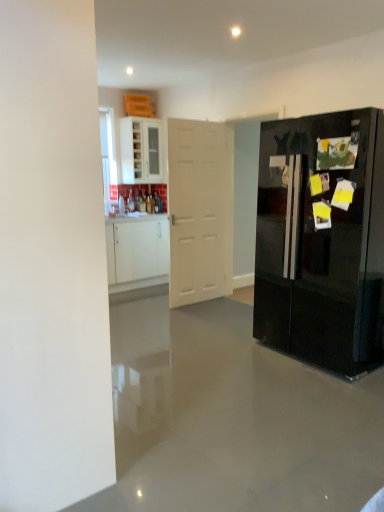
Question: Does glossy black refrigerator at right have a greater height compared to white matte door at center?

Choices:
 (A) no
 (B) yes

Answer: (A)

Question: Is white matte door at center inside glossy black refrigerator at right?

Choices:
 (A) no
 (B) yes

Answer: (A)

Question: Is glossy black refrigerator at right not within white matte door at center?

Choices:
 (A) yes
 (B) no

Answer: (A)

Question: From a real-world perspective, is glossy black refrigerator at right physically below white matte door at center?

Choices:
 (A) yes
 (B) no

Answer: (A)

Question: Does glossy black refrigerator at right have a greater width compared to white matte door at center?

Choices:
 (A) yes
 (B) no

Answer: (A)

Question: From their relative heights in the image, would you say glossy black refrigerator at right is taller or shorter than white glossy cabinet at upper left?

Choices:
 (A) tall
 (B) short

Answer: (A)

Question: Considering the positions of glossy black refrigerator at right and white glossy cabinet at upper left in the image, is glossy black refrigerator at right wider or thinner than white glossy cabinet at upper left?

Choices:
 (A) wide
 (B) thin

Answer: (A)

Question: From the image's perspective, is glossy black refrigerator at right located above or below white glossy cabinet at upper left?

Choices:
 (A) above
 (B) below

Answer: (B)

Question: From a real-world perspective, is glossy black refrigerator at right physically located above or below white glossy cabinet at upper left?

Choices:
 (A) above
 (B) below

Answer: (B)

Question: Considering the positions of white glossy cabinet at upper left and white matte door at center in the image, is white glossy cabinet at upper left taller or shorter than white matte door at center?

Choices:
 (A) short
 (B) tall

Answer: (A)

Question: Is white glossy cabinet at upper left inside the boundaries of white matte door at center, or outside?

Choices:
 (A) inside
 (B) outside

Answer: (B)

Question: In the image, is white glossy cabinet at upper left on the left side or the right side of white matte door at center?

Choices:
 (A) right
 (B) left

Answer: (B)

Question: Considering their positions, is white glossy cabinet at upper left located in front of or behind white matte door at center?

Choices:
 (A) front
 (B) behind

Answer: (B)

Question: Based on their sizes in the image, would you say white matte door at center is bigger or smaller than glossy black refrigerator at right?

Choices:
 (A) big
 (B) small

Answer: (B)

Question: Is white matte door at center situated inside glossy black refrigerator at right or outside?

Choices:
 (A) inside
 (B) outside

Answer: (B)